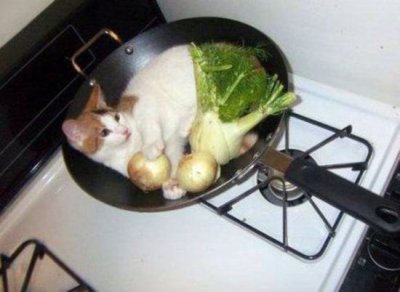
Identify the location of aluminum piece of handle. Image resolution: width=400 pixels, height=292 pixels. (269, 157).